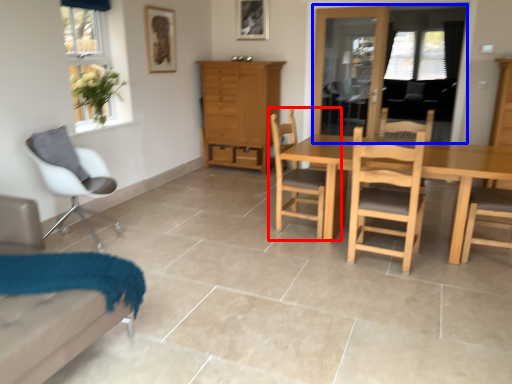
Question: Which object appears closest to the camera in this image, chair (highlighted by a red box) or window screen (highlighted by a blue box)?

Choices:
 (A) chair
 (B) window screen

Answer: (A)